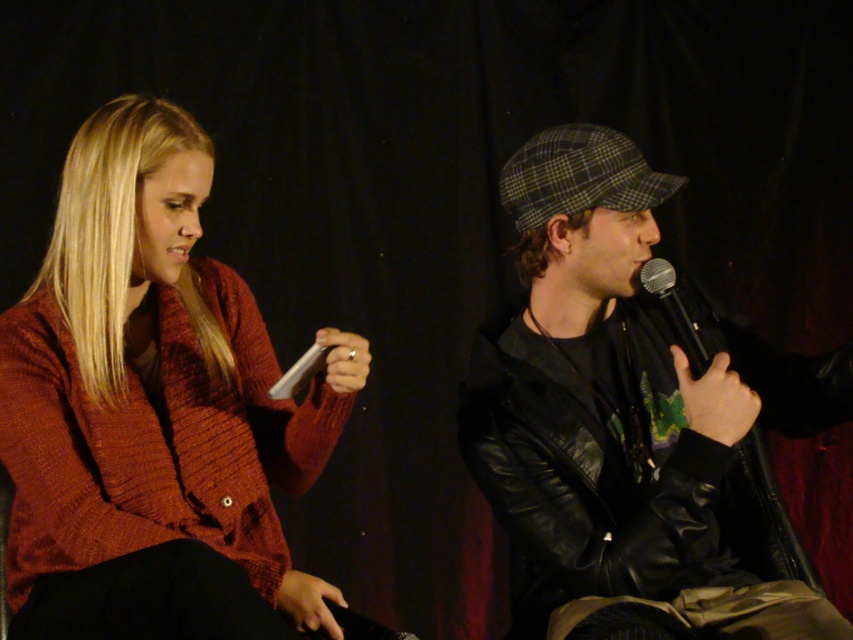
Is knitted wool sweater at left positioned behind black metallic microphone at center?

No, knitted wool sweater at left is closer to the viewer.

From the picture: Who is lower down, knitted wool sweater at left or black metallic microphone at center?

knitted wool sweater at left

You are a GUI agent. You are given a task and a screenshot of the screen. Output one action in this format:
    pyautogui.click(x=<x>, y=<y>)
    Task: Click on the knitted wool sweater at left
    
    Given the screenshot: What is the action you would take?
    pyautogui.click(x=154, y=410)

Find the location of a particular element. The image size is (853, 640). knitted wool sweater at left is located at coordinates (154, 410).

Based on the photo, does leather jacket at center have a larger size compared to black metallic microphone at center?

Yes.

Where is `leather jacket at center`? This screenshot has height=640, width=853. leather jacket at center is located at coordinates (631, 426).

Who is positioned more to the left, knitted wool sweater at left or leather jacket at center?

From the viewer's perspective, knitted wool sweater at left appears more on the left side.

Which is below, knitted wool sweater at left or leather jacket at center?

leather jacket at center is below.

Identify the location of knitted wool sweater at left. (154, 410).